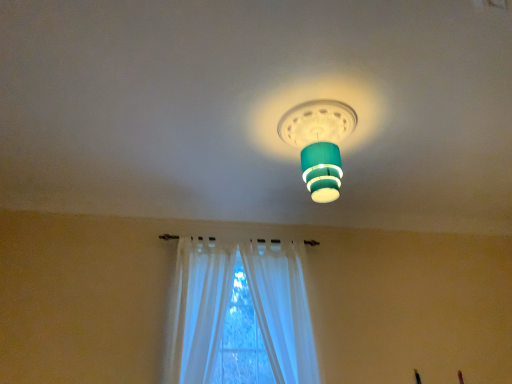
Question: Is point [x=204, y=324] positioned closer to the camera than point [x=252, y=253]?

Choices:
 (A) farther
 (B) closer

Answer: (B)

Question: Is white sheer curtain at lower center, the 2th curtain in the right-to-left sequence, wider or thinner than white sheer curtain at center, which is counted as the first curtain, starting from the right?

Choices:
 (A) wide
 (B) thin

Answer: (A)

Question: Estimate the real-world distances between objects in this image. Which object is closer to the white sheer curtain at center, which is counted as the first curtain, starting from the right?

Choices:
 (A) teal matte lampshade at center
 (B) white sheer curtain at lower center, the 2th curtain in the right-to-left sequence

Answer: (B)

Question: Which object is the farthest from the white sheer curtain at center, which is the 2th curtain from left to right?

Choices:
 (A) white sheer curtain at lower center, which ranks as the first curtain in left-to-right order
 (B) teal matte lampshade at center

Answer: (B)